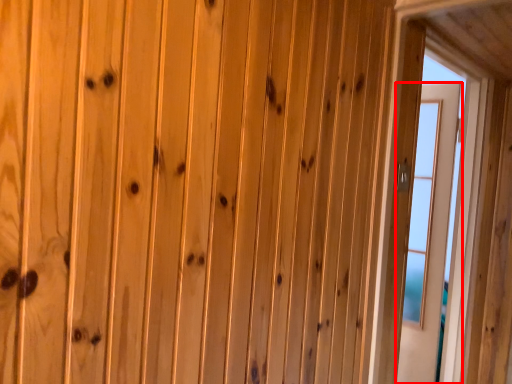
Question: From the image's perspective, what is the correct spatial relationship of door (annotated by the red box) in relation to window?

Choices:
 (A) below
 (B) above

Answer: (A)